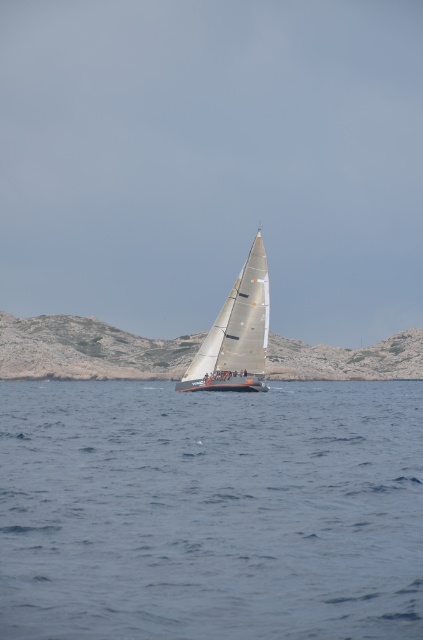
Consider the image. Who is more distant from viewer, (126, 628) or (236, 320)?

Positioned behind is point (236, 320).

Which is more to the right, blue water at center or white matte sailboat at center?

From the viewer's perspective, white matte sailboat at center appears more on the right side.

The height and width of the screenshot is (640, 423). What do you see at coordinates (211, 512) in the screenshot? I see `blue water at center` at bounding box center [211, 512].

You are a GUI agent. You are given a task and a screenshot of the screen. Output one action in this format:
    pyautogui.click(x=<x>, y=<y>)
    Task: Click on the blue water at center
    
    Given the screenshot: What is the action you would take?
    pyautogui.click(x=211, y=512)